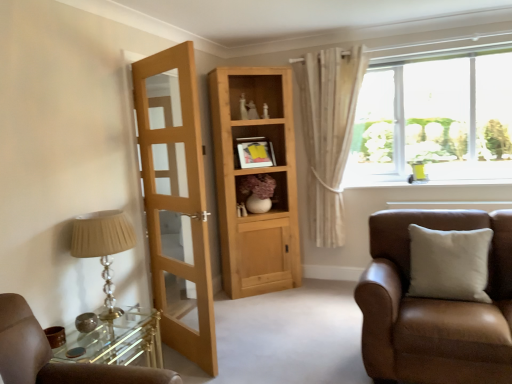
Find the location of a particular element. The height and width of the screenshot is (384, 512). natural wood cabinet at center is located at coordinates (255, 174).

You are a GUI agent. You are given a task and a screenshot of the screen. Output one action in this format:
    pyautogui.click(x=<x>, y=<y>)
    Task: Click on the white matte pillow at right
    This screenshot has width=512, height=384.
    Given the screenshot: What is the action you would take?
    pyautogui.click(x=449, y=263)

In order to face matte wooden cabinet at center, should I rotate leftwards or rightwards?

Turn right approximately 0.576 degrees to face it.

Locate an element on the screen. matte wooden cabinet at center is located at coordinates (280, 193).

Image resolution: width=512 pixels, height=384 pixels. I want to click on natural wood cabinet at center, so click(x=255, y=174).

Does clear glass window at upper right turn towards matte beige lampshade at left?

Yes.

Between clear glass window at upper right and matte beige lampshade at left, which one appears on the left side from the viewer's perspective?

From the viewer's perspective, matte beige lampshade at left appears more on the left side.

How many degrees apart are the facing directions of clear glass window at upper right and matte beige lampshade at left?

The angular difference between clear glass window at upper right and matte beige lampshade at left is 90 degrees.

Is natural wood cabinet at center looking in the opposite direction of white textured curtain at upper right?

natural wood cabinet at center does not have its back to white textured curtain at upper right.

In terms of width, does natural wood cabinet at center look wider or thinner when compared to white textured curtain at upper right?

Considering their sizes, natural wood cabinet at center looks broader than white textured curtain at upper right.

From a real-world perspective, is natural wood cabinet at center over white textured curtain at upper right?

No, from a real-world perspective, natural wood cabinet at center is not on top of white textured curtain at upper right.

From the image's perspective, is natural wood cabinet at center on top of white textured curtain at upper right?

No, from the image's perspective, natural wood cabinet at center is not over white textured curtain at upper right.

Can we say white textured curtain at upper right lies outside light brown wooden door at left?

white textured curtain at upper right is positioned outside light brown wooden door at left.

Who is bigger, white textured curtain at upper right or light brown wooden door at left?

With larger size is light brown wooden door at left.

Is white textured curtain at upper right positioned behind light brown wooden door at left?

Yes, it is.

Is white textured curtain at upper right touching light brown wooden door at left?

No, white textured curtain at upper right is not next to light brown wooden door at left.

Could white textured curtain at upper right be considered to be inside white glossy window sill at upper right?

No, white textured curtain at upper right is located outside of white glossy window sill at upper right.

From the image's perspective, is white glossy window sill at upper right beneath white textured curtain at upper right?

Yes, from the image's perspective, white glossy window sill at upper right is beneath white textured curtain at upper right.

Is white glossy window sill at upper right facing away from white textured curtain at upper right?

white glossy window sill at upper right is not turned away from white textured curtain at upper right.

Considering the relative sizes of white glossy window sill at upper right and white textured curtain at upper right in the image provided, is white glossy window sill at upper right bigger than white textured curtain at upper right?

No, white glossy window sill at upper right is not bigger than white textured curtain at upper right.

Measure the distance between light brown wooden door at left and matte beige lampshade at left.

The distance of light brown wooden door at left from matte beige lampshade at left is 23.03 inches.

Which object is positioned more to the right, light brown wooden door at left or matte beige lampshade at left?

From the viewer's perspective, light brown wooden door at left appears more on the right side.

Is light brown wooden door at left shorter than matte beige lampshade at left?

No.

Which is behind, point (189, 257) or point (113, 302)?

The point (189, 257) is more distant.

Does point (345, 156) come farther from viewer compared to point (392, 81)?

No, it is in front of (392, 81).

Is clear glass window at upper right inside white textured curtain at upper right?

No, clear glass window at upper right is not surrounded by white textured curtain at upper right.

From the image's perspective, is white textured curtain at upper right above or below clear glass window at upper right?

white textured curtain at upper right is below clear glass window at upper right.

How different are the orientations of white glossy window sill at upper right and clear glass window at upper right in degrees?

They differ by 0.515 degrees in their facing directions.

From the picture: Is white glossy window sill at upper right taller than clear glass window at upper right?

Incorrect, the height of white glossy window sill at upper right is not larger of that of clear glass window at upper right.

Is point (387, 180) farther from camera compared to point (405, 118)?

Yes, point (387, 180) is behind point (405, 118).

From the image's perspective, which one is positioned higher, white glossy window sill at upper right or clear glass window at upper right?

From the image's view, clear glass window at upper right is above.

Where is `window lying behind the matte beige lampshade at left`? The width and height of the screenshot is (512, 384). window lying behind the matte beige lampshade at left is located at coordinates [x=434, y=120].

Identify the location of cabinetry below the white textured curtain at upper right (from the image's perspective). (255, 174).

When comparing their distances from natural wood cabinet at center, does brown leather chair at right or clear glass window at upper right seem closer?

clear glass window at upper right is positioned closer to the anchor natural wood cabinet at center.

When comparing their distances from light brown wooden door at left, does white matte pillow at right or clear glass window at upper right seem closer?

white matte pillow at right.

From the image, which object appears to be nearer to light brown wooden door at left, brown leather chair at right or natural wood cabinet at center?

natural wood cabinet at center.

Looking at the image, which one is located further to matte black picture frame at center, clear glass window at upper right or matte wooden cabinet at center?

clear glass window at upper right is positioned further to the anchor matte black picture frame at center.

When comparing their distances from matte wooden cabinet at center, does white textured curtain at upper right or brown leather chair at right seem closer?

Among the two, white textured curtain at upper right is located nearer to matte wooden cabinet at center.

Considering their positions, is matte beige lampshade at left positioned further to light brown wooden door at left than white glossy window sill at upper right?

white glossy window sill at upper right is further to light brown wooden door at left.

Considering their positions, is light brown wooden door at left positioned closer to matte wooden cabinet at center than natural wood cabinet at center?

natural wood cabinet at center lies closer to matte wooden cabinet at center than the other object.

Estimate the real-world distances between objects in this image. Which object is closer to light brown wooden door at left, matte black picture frame at center or white textured curtain at upper right?

Among the two, matte black picture frame at center is located nearer to light brown wooden door at left.

Locate an element on the screen. The image size is (512, 384). door between matte beige lampshade at left and matte wooden cabinet at center in the front-back direction is located at coordinates (176, 201).

The image size is (512, 384). Find the location of `cabinet between light brown wooden door at left and white matte pillow at right in the horizontal direction`. cabinet between light brown wooden door at left and white matte pillow at right in the horizontal direction is located at coordinates (280, 193).

The image size is (512, 384). Find the location of `curtain situated between natural wood cabinet at center and white glossy window sill at upper right from left to right`. curtain situated between natural wood cabinet at center and white glossy window sill at upper right from left to right is located at coordinates pyautogui.click(x=328, y=132).

The height and width of the screenshot is (384, 512). What are the coordinates of `picture frame located between matte beige lampshade at left and white glossy window sill at upper right in the left-right direction` in the screenshot? It's located at (255, 152).